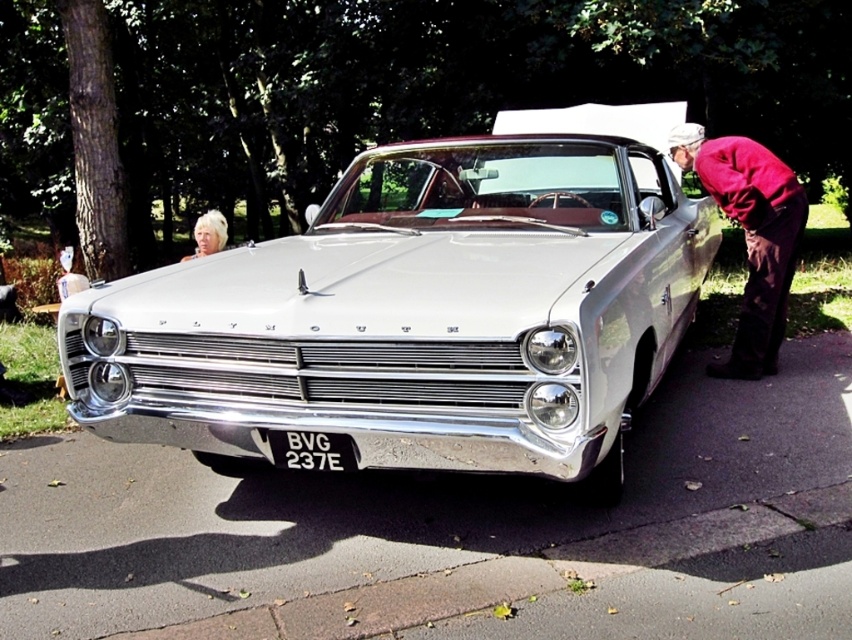
You are a photographer standing at the rear of the vintage Plymouth car. You want to take a photo of the black plastic license plate at center and the blonde hair at upper left in the same frame. Can you position yourself so that both are visible without moving either object?

The black plastic license plate at center and blonde hair at upper left are 3.15 meters apart. Since the photographer is at the rear of the car, they can position themselves to capture both objects in the frame as they are separated by a distance that allows visibility within a standard camera lens range.

Consider the image. You are a photographer at a car show and want to capture both the maroon fabric coat at right and the blonde hair at upper left in the same frame. Which object should you focus on first to ensure both are in the frame?

The maroon fabric coat at right is taller than the blonde hair at upper left, so you should focus on the maroon fabric coat at right first to ensure both are in the frame.

You are standing at the back of the vintage Plymouth car and want to walk to the front. Which point, point (323, 435) or point (200, 243), is closer to the front of the car?

Point (323, 435) is closer to the front of the vintage Plymouth car because it is in front of point (200, 243).